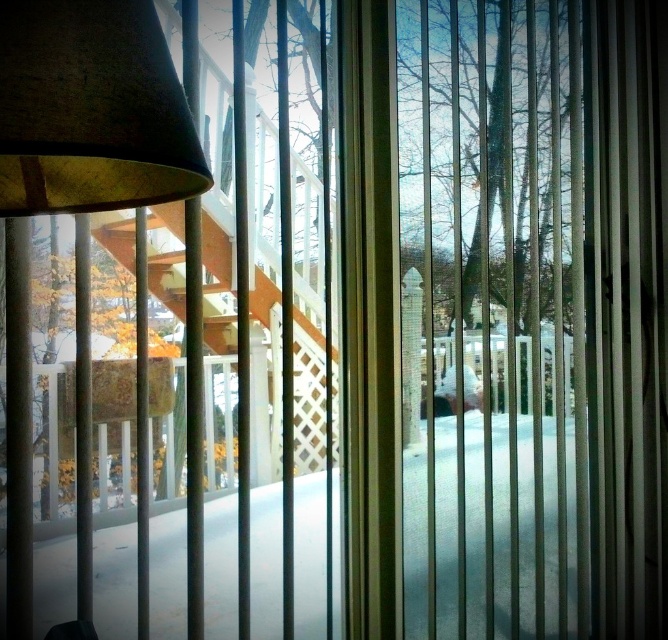
You are a delivery person trying to place a package between the translucent plastic curtain at center and the matte brown lampshade at left. The package is 4 feet long. Can you fit the package in the space between them?

The space between the translucent plastic curtain at center and the matte brown lampshade at left is 4.68 feet. Since the package is 4 feet long, it can fit in the space between them as it is shorter than the available distance.

You are standing in a room with vertical blinds and looking through them at a snowy deck. There are two points marked in the image, one at coordinate point (615, 435) and another at point (35, 35). Which of these points is closer to you as you look through the blinds?

Point (35, 35) is closer to you because it is nearer to the camera than point (615, 435).